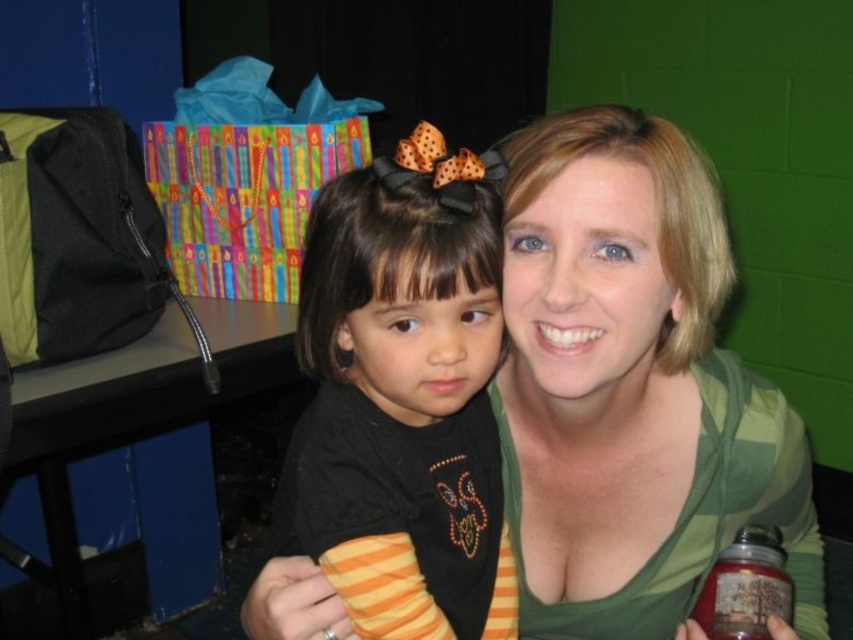
You are standing in front of the image and want to locate the green striped shirt at upper center. Can you tell me its exact position in the image?

The green striped shirt at upper center is located at point (631,387).

You are standing in front of the image and want to reach the green striped shirt at upper center. The maximum distance you can reach is 24 inches. Can you touch it?

The green striped shirt at upper center is 23.62 inches away from the viewer, so yes, you can touch it since your maximum reach is 24 inches which is slightly longer than the distance.

You are a photographer trying to adjust the lighting for a photo shoot. You notice the green striped shirt at upper center and the black matte shirt at center. Which shirt is positioned lower in the frame?

The green striped shirt at upper center is positioned below the black matte shirt at center, so it is lower in the frame.